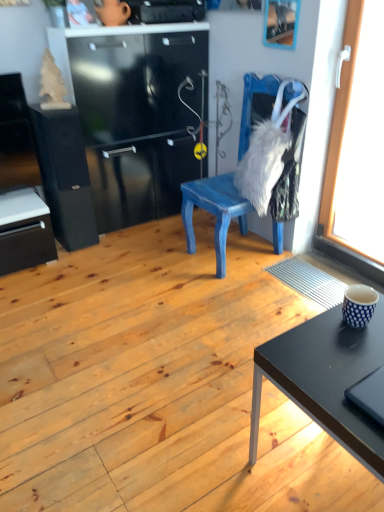
This screenshot has height=512, width=384. Find the location of `free space above black matte desk at lower right (from a real-world perspective)`. free space above black matte desk at lower right (from a real-world perspective) is located at coordinates (348, 350).